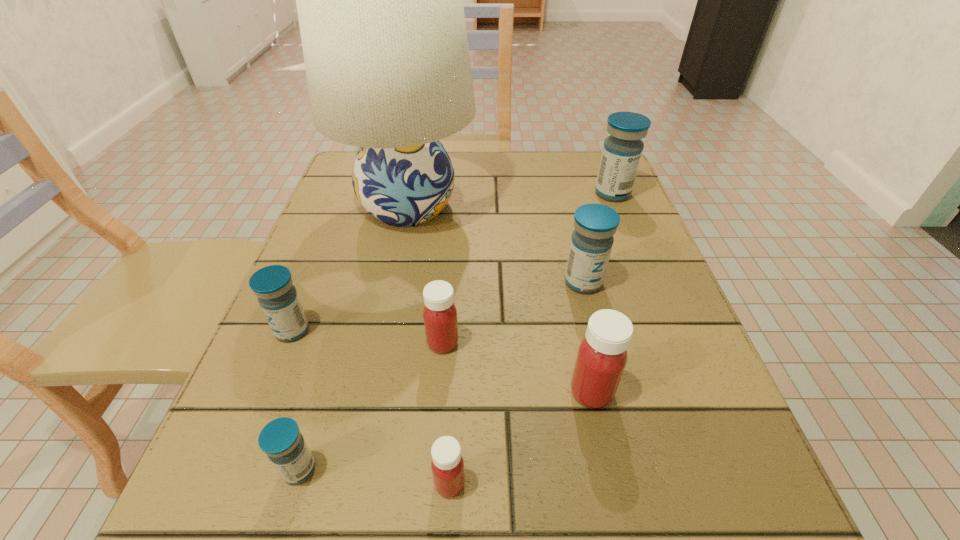
I want to click on the farthest red medicine, so click(x=440, y=314).

Image resolution: width=960 pixels, height=540 pixels. What are the coordinates of `the smallest blue medicine` in the screenshot? It's located at (280, 439).

Identify the location of the nearest blue medicine. The height and width of the screenshot is (540, 960). (280, 439).

You are a GUI agent. You are given a task and a screenshot of the screen. Output one action in this format:
    pyautogui.click(x=<x>, y=<y>)
    Task: Click on the smallest red medicine
    This screenshot has width=960, height=540.
    Given the screenshot: What is the action you would take?
    pyautogui.click(x=447, y=465)

You are a GUI agent. You are given a task and a screenshot of the screen. Output one action in this format:
    pyautogui.click(x=<x>, y=<y>)
    Task: Click on the free space located on the front-facing side of the lampshade
    The width and height of the screenshot is (960, 540).
    Given the screenshot: What is the action you would take?
    pyautogui.click(x=617, y=206)

I want to click on vacant space located 0.220m on the left of the farthest blue medicine, so click(x=501, y=193).

The image size is (960, 540). I want to click on free space located 0.310m on the back of the sixth nearest object, so click(x=559, y=184).

Where is `blank space located on the back of the second farthest red medicine`? The width and height of the screenshot is (960, 540). blank space located on the back of the second farthest red medicine is located at coordinates (572, 302).

Where is `blank space located 0.380m on the right of the third biggest blue medicine`? The image size is (960, 540). blank space located 0.380m on the right of the third biggest blue medicine is located at coordinates (538, 330).

Find the location of a particular element. Image resolution: width=960 pixels, height=540 pixels. free spot located 0.050m on the back of the second smallest red medicine is located at coordinates (445, 308).